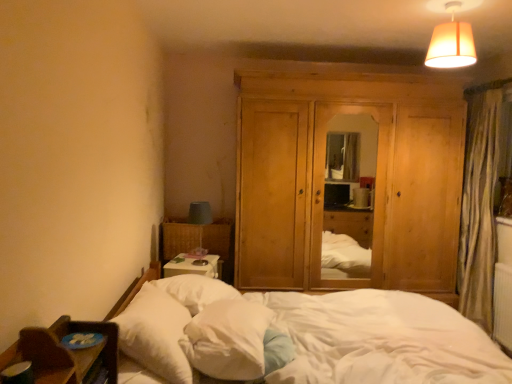
Measure the distance between point (180, 319) and camera.

6.73 feet.

Find the location of a particular element. Image resolution: width=512 pixels, height=384 pixels. white soft pillow at center, the first pillow when ordered from right to left is located at coordinates (228, 339).

In order to face white soft bed at lower left, should I rotate leftwards or rightwards?

Rotate right and turn 8.173 degrees.

Identify the location of white soft pillow at lower left, which ranks as the second pillow in right-to-left order. The image size is (512, 384). (156, 334).

Between white soft pillow at lower left, which appears as the first pillow when viewed from the left, and white soft pillow at center, the first pillow when ordered from right to left, which one has larger size?

white soft pillow at lower left, which appears as the first pillow when viewed from the left.

Does white soft pillow at lower left, which ranks as the second pillow in right-to-left order, lie in front of white soft pillow at center, the first pillow when ordered from right to left?

Yes, white soft pillow at lower left, which ranks as the second pillow in right-to-left order, is in front of white soft pillow at center, the first pillow when ordered from right to left.

What's the angular difference between white soft pillow at lower left, which ranks as the second pillow in right-to-left order, and white soft pillow at center, the first pillow when ordered from right to left,'s facing directions?

9.43 degrees.

Which is more to the right, white soft pillow at lower left, which appears as the first pillow when viewed from the left, or white soft pillow at center, the first pillow when ordered from right to left?

From the viewer's perspective, white soft pillow at center, the first pillow when ordered from right to left, appears more on the right side.

Would you say white soft bed at lower left is a long distance from white soft pillow at lower left, which appears as the first pillow when viewed from the left?

white soft bed at lower left is actually quite close to white soft pillow at lower left, which appears as the first pillow when viewed from the left.

Could you measure the distance between white soft bed at lower left and white soft pillow at lower left, which ranks as the second pillow in right-to-left order?

white soft bed at lower left is 32.63 inches from white soft pillow at lower left, which ranks as the second pillow in right-to-left order.

Considering the relative sizes of white soft bed at lower left and white soft pillow at lower left, which ranks as the second pillow in right-to-left order, in the image provided, is white soft bed at lower left smaller than white soft pillow at lower left, which ranks as the second pillow in right-to-left order,?

No, white soft bed at lower left is not smaller than white soft pillow at lower left, which ranks as the second pillow in right-to-left order.

The width and height of the screenshot is (512, 384). In order to click on the 1st pillow behind the white soft bed at lower left in this screenshot , I will do `click(156, 334)`.

Does natural wood dresser at center come in front of white soft pillow at lower left, which ranks as the second pillow in right-to-left order?

No, natural wood dresser at center is behind white soft pillow at lower left, which ranks as the second pillow in right-to-left order.

Considering the sizes of objects natural wood dresser at center and white soft pillow at lower left, which appears as the first pillow when viewed from the left, in the image provided, who is wider, natural wood dresser at center or white soft pillow at lower left, which appears as the first pillow when viewed from the left,?

Wider between the two is natural wood dresser at center.

Is natural wood dresser at center inside or outside of white soft pillow at lower left, which ranks as the second pillow in right-to-left order?

natural wood dresser at center exists outside the volume of white soft pillow at lower left, which ranks as the second pillow in right-to-left order.

Does matte beige lampshade at upper right appear on the left side of white soft pillow at lower left, which appears as the first pillow when viewed from the left?

Incorrect, matte beige lampshade at upper right is not on the left side of white soft pillow at lower left, which appears as the first pillow when viewed from the left.

Considering the sizes of objects matte beige lampshade at upper right and white soft pillow at lower left, which ranks as the second pillow in right-to-left order, in the image provided, who is shorter, matte beige lampshade at upper right or white soft pillow at lower left, which ranks as the second pillow in right-to-left order,?

white soft pillow at lower left, which ranks as the second pillow in right-to-left order.

Is white soft bed at lower left in contact with natural wood dresser at center?

white soft bed at lower left and natural wood dresser at center are clearly separated.

Which object is further away from the camera taking this photo, white soft bed at lower left or natural wood dresser at center?

natural wood dresser at center is further away from the camera.

Is white soft bed at lower left taller or shorter than natural wood dresser at center?

white soft bed at lower left is shorter than natural wood dresser at center.

Can you confirm if white soft bed at lower left is smaller than natural wood dresser at center?

Yes.

What's the angular difference between white soft pillow at center, the second pillow when ordered from left to right, and natural wood dresser at center's facing directions?

The angular difference between white soft pillow at center, the second pillow when ordered from left to right, and natural wood dresser at center is 79.1 degrees.

Is white soft pillow at center, the first pillow when ordered from right to left, outside of natural wood dresser at center?

Yes.

Does white soft pillow at center, the first pillow when ordered from right to left, appear on the right side of natural wood dresser at center?

No, white soft pillow at center, the first pillow when ordered from right to left, is not to the right of natural wood dresser at center.

Considering the sizes of objects white soft pillow at center, the first pillow when ordered from right to left, and natural wood dresser at center in the image provided, who is bigger, white soft pillow at center, the first pillow when ordered from right to left, or natural wood dresser at center?

natural wood dresser at center.

What's the angular difference between matte beige lampshade at upper right and white soft pillow at center, the first pillow when ordered from right to left,'s facing directions?

They differ by 78.7 degrees in their facing directions.

Which of these two, matte beige lampshade at upper right or white soft pillow at center, the second pillow when ordered from left to right, is smaller?

matte beige lampshade at upper right.

From a real-world perspective, between matte beige lampshade at upper right and white soft pillow at center, the first pillow when ordered from right to left, who is vertically higher?

From a 3D spatial view, matte beige lampshade at upper right is above.

Is matte beige lampshade at upper right surrounding white soft pillow at center, the first pillow when ordered from right to left?

That's incorrect, white soft pillow at center, the first pillow when ordered from right to left, is not inside matte beige lampshade at upper right.

Where is `pillow on the right side of white soft pillow at lower left, which ranks as the second pillow in right-to-left order`? The width and height of the screenshot is (512, 384). pillow on the right side of white soft pillow at lower left, which ranks as the second pillow in right-to-left order is located at coordinates (228, 339).

Identify the location of bed that appears below the white soft pillow at lower left, which appears as the first pillow when viewed from the left (from the image's perspective). (381, 340).

From the image, which object appears to be farther from white soft pillow at lower left, which ranks as the second pillow in right-to-left order, white soft pillow at center, the first pillow when ordered from right to left, or matte beige lampshade at upper right?

matte beige lampshade at upper right lies further to white soft pillow at lower left, which ranks as the second pillow in right-to-left order, than the other object.

Considering their positions, is white soft pillow at lower left, which appears as the first pillow when viewed from the left, positioned closer to white soft pillow at center, the first pillow when ordered from right to left, than natural wood dresser at center?

The object closer to white soft pillow at center, the first pillow when ordered from right to left, is white soft pillow at lower left, which appears as the first pillow when viewed from the left.

Based on their spatial positions, is natural wood dresser at center or white soft pillow at lower left, which appears as the first pillow when viewed from the left, closer to white soft bed at lower left?

white soft pillow at lower left, which appears as the first pillow when viewed from the left, lies closer to white soft bed at lower left than the other object.

When comparing their distances from white soft pillow at center, the second pillow when ordered from left to right, does white soft bed at lower left or white soft pillow at lower left, which ranks as the second pillow in right-to-left order, seem closer?

white soft pillow at lower left, which ranks as the second pillow in right-to-left order.

Considering their positions, is matte beige lampshade at upper right positioned closer to white soft pillow at center, the second pillow when ordered from left to right, than white soft pillow at lower left, which ranks as the second pillow in right-to-left order?

white soft pillow at lower left, which ranks as the second pillow in right-to-left order, lies closer to white soft pillow at center, the second pillow when ordered from left to right, than the other object.

Looking at this image, based on their spatial positions, is white soft pillow at lower left, which appears as the first pillow when viewed from the left, or white soft pillow at center, the first pillow when ordered from right to left, closer to natural wood dresser at center?

white soft pillow at center, the first pillow when ordered from right to left, is closer to natural wood dresser at center.

Looking at the image, which one is located closer to matte beige lampshade at upper right, white soft pillow at lower left, which appears as the first pillow when viewed from the left, or natural wood dresser at center?

natural wood dresser at center is closer to matte beige lampshade at upper right.

Based on their spatial positions, is white soft pillow at center, the first pillow when ordered from right to left, or matte beige lampshade at upper right closer to white soft bed at lower left?

The object closer to white soft bed at lower left is white soft pillow at center, the first pillow when ordered from right to left.

Where is `dresser between matte beige lampshade at upper right and white soft pillow at center, the second pillow when ordered from left to right, in the up-down direction`? Image resolution: width=512 pixels, height=384 pixels. dresser between matte beige lampshade at upper right and white soft pillow at center, the second pillow when ordered from left to right, in the up-down direction is located at coordinates (324, 180).

At what (x,y) coordinates should I click in order to perform the action: click on pillow located between white soft pillow at lower left, which appears as the first pillow when viewed from the left, and natural wood dresser at center in the depth direction. Please return your answer as a coordinate pair (x, y). This screenshot has height=384, width=512. Looking at the image, I should click on (228, 339).

Where is `dresser between white soft pillow at lower left, which appears as the first pillow when viewed from the left, and matte beige lampshade at upper right from left to right`? dresser between white soft pillow at lower left, which appears as the first pillow when viewed from the left, and matte beige lampshade at upper right from left to right is located at coordinates (324, 180).

I want to click on pillow situated between white soft pillow at lower left, which appears as the first pillow when viewed from the left, and white soft bed at lower left from left to right, so click(x=228, y=339).